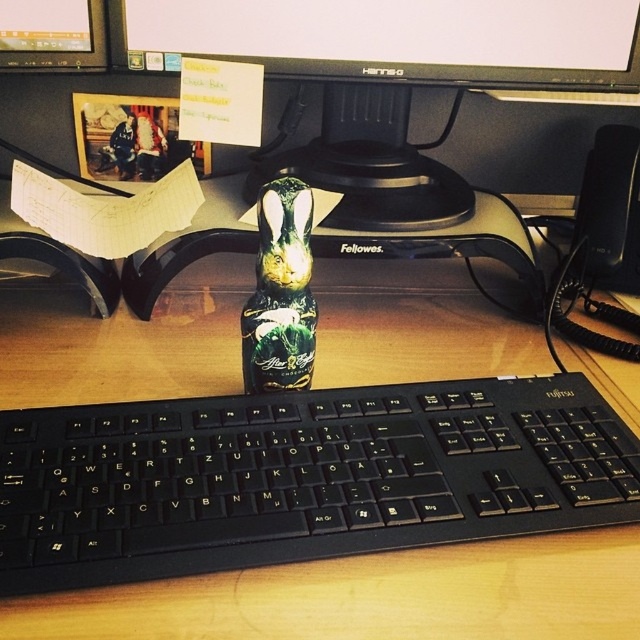
You are a person sitting at the desk and want to reach for the matte black monitor at upper center. Is the black plastic keyboard at center in your way?

The black plastic keyboard at center is closer to the viewer than the matte black monitor at upper center, so yes, the black plastic keyboard at center is blocking your view to the matte black monitor at upper center.

You are organizing your desk and want to place a new item between the black glossy computer monitor at upper center and the green matte bottle at center. Based on their positions, which object is closer to you, making the space between them accessible?

The black glossy computer monitor at upper center is closer to you than the green matte bottle at center, so the space between them is accessible.